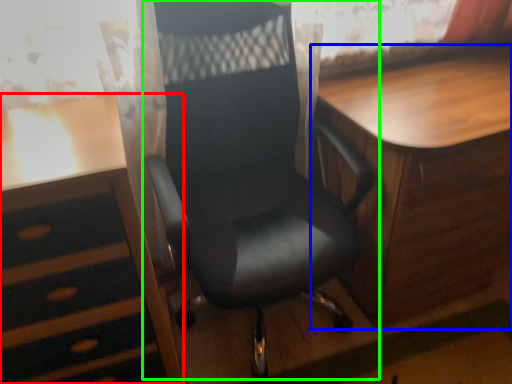
Question: Which object is positioned farthest from desk (highlighted by a red box)? Select from table (highlighted by a blue box) and chair (highlighted by a green box).

Choices:
 (A) table
 (B) chair

Answer: (A)